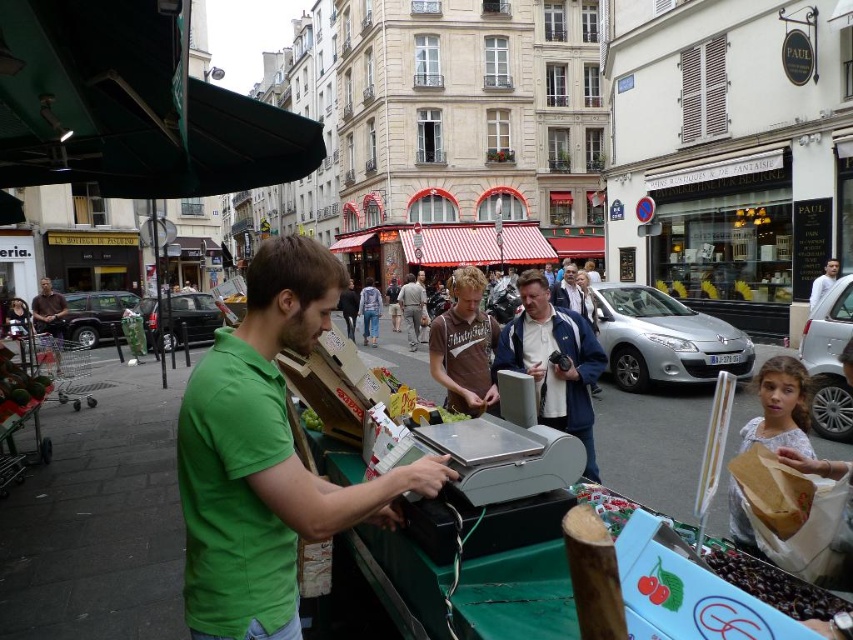
Is green matte shirt at center in front of matte gray cash register at center?

Yes, green matte shirt at center is in front of matte gray cash register at center.

Does green matte shirt at center appear on the left side of matte gray cash register at center?

Correct, you'll find green matte shirt at center to the left of matte gray cash register at center.

Is point (221, 609) positioned before point (529, 355)?

Yes.

At what (x,y) coordinates should I click in order to perform the action: click on green matte shirt at center. Please return your answer as a coordinate pair (x, y). This screenshot has width=853, height=640. Looking at the image, I should click on (265, 456).

Where is `green matte shirt at center`? Image resolution: width=853 pixels, height=640 pixels. green matte shirt at center is located at coordinates (265, 456).

Is point (437, 481) positioned in front of point (419, 289)?

Yes, it is.

Is point (199, 435) positioned before point (422, 292)?

Yes, point (199, 435) is in front of point (422, 292).

Identify the location of green matte shirt at center. Image resolution: width=853 pixels, height=640 pixels. (265, 456).

Does matte gray cash register at center appear on the right side of brown cotton shirt at center?

Correct, you'll find matte gray cash register at center to the right of brown cotton shirt at center.

Describe the element at coordinates (553, 362) in the screenshot. This screenshot has width=853, height=640. I see `matte gray cash register at center` at that location.

This screenshot has height=640, width=853. In order to click on matte gray cash register at center in this screenshot , I will do `click(553, 362)`.